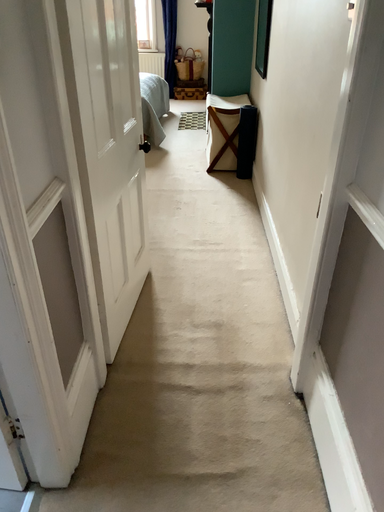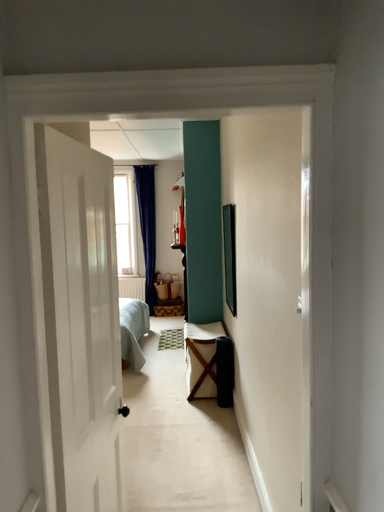
Question: Which way did the camera rotate in the video?

Choices:
 (A) rotated upward
 (B) rotated downward

Answer: (A)